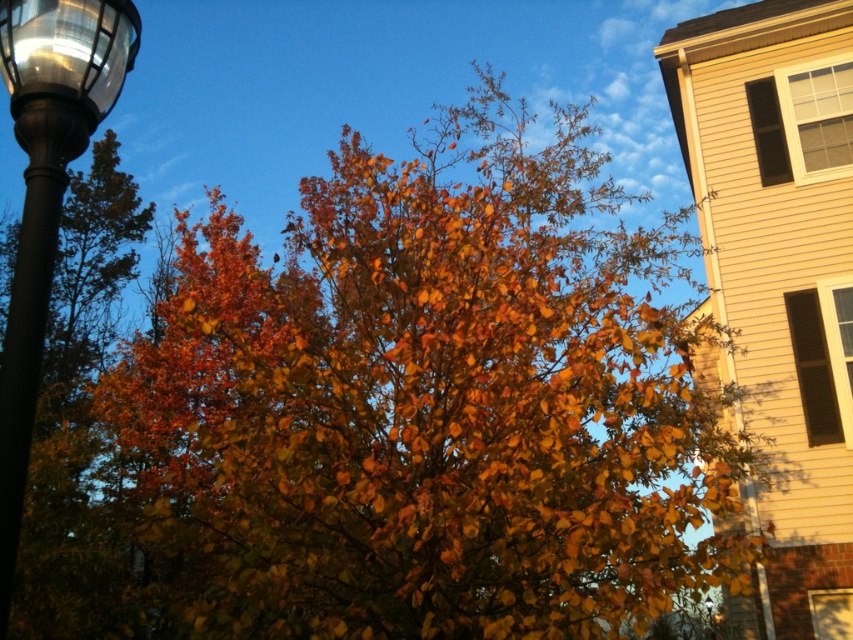
You are standing at the center of the image and want to place a small bench. The bench requires a space that is not occupied by the autumn leaves at center. Where should you place it?

The autumn leaves at center are located at point (424, 406). To avoid placing the bench where the autumn leaves at center are, you should position it away from that coordinate.

You are a painter standing in front of the autumn scene. You want to paint the autumn leaves at center and the metallic glass streetlight at upper left. Which object is wider in the image?

The autumn leaves at center might be wider than metallic glass streetlight at upper left according to the description.

You are a city planner assessing the placement of streetlights in a park. You notice the polished metal street light at left and the metallic glass streetlight at upper left. Which of these two streetlights has a smaller diameter?

The polished metal street light at left has a smaller diameter than the metallic glass streetlight at upper left.